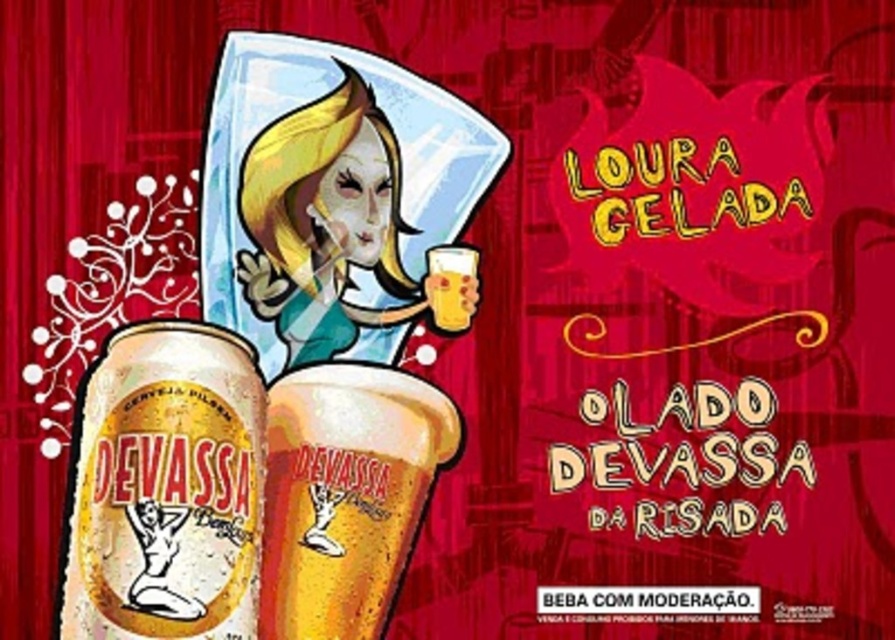
You have a translucent plastic cup at center and a translucent glass beer at center in front of you. Which one has a greater width?

The translucent plastic cup at center has a greater width than the translucent glass beer at center.

You are a customer at a bar and see the translucent plastic cup at center and the matte white face at center in front of you. Which object is closer to your right hand?

The matte white face at center is closer to your right hand because the translucent plastic cup at center is to the left of it.